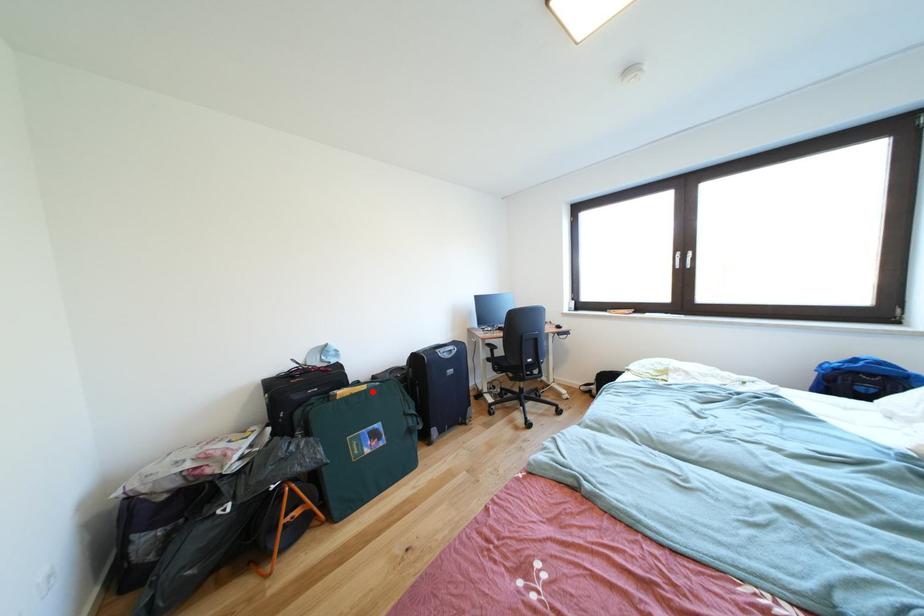
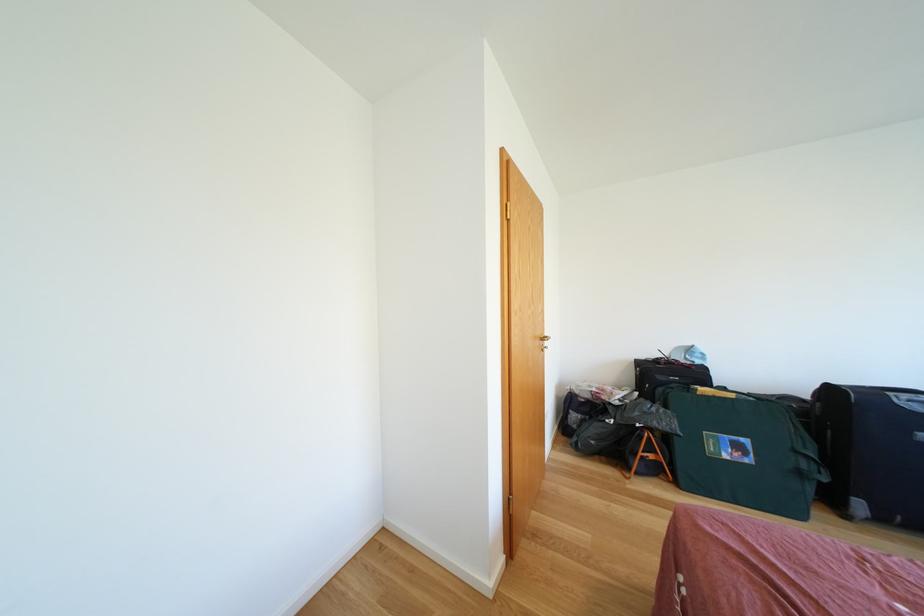
In the second image, find the point that corresponds to the highlighted location in the first image.

(739, 400)